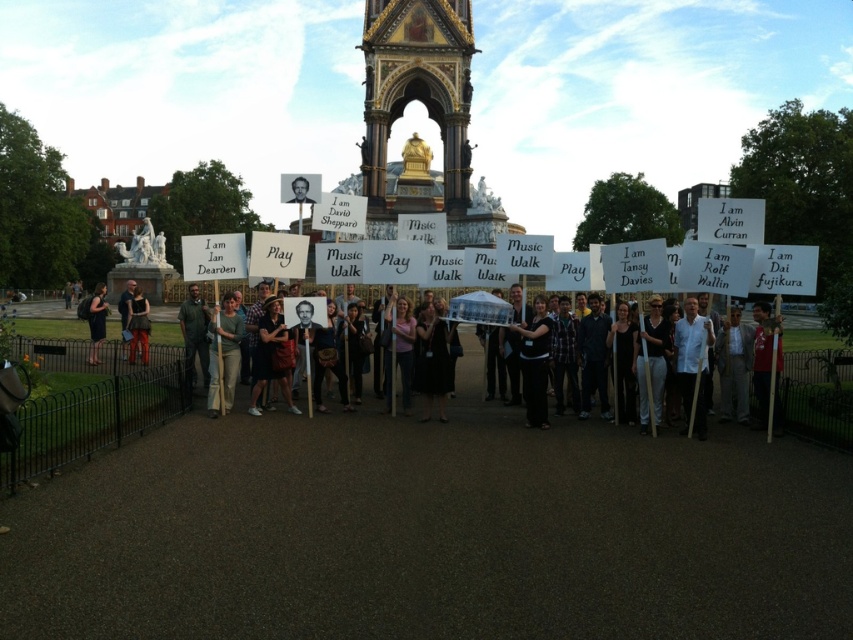
You are a photographer trying to capture a candid shot of the matte black dress at center and the dark brown leather jacket at center. Since you want both items to be clearly visible in the frame, which one should you focus on first to ensure proper depth of field?

The matte black dress at center is much taller than the dark brown leather jacket at center, so focusing on the taller matte black dress at center first would ensure both are in focus due to its greater distance from the camera.

You are a photographer trying to capture a photo of both the dark green shirt at center and the dark brown leather jacket at center. Since you want both to be clearly visible in the photo, which one should you focus on first to ensure the other remains in focus?

You should focus on the dark green shirt at center first because it is closer to the viewer than the dark brown leather jacket at center. By focusing on the closer object, the farther one will still be in focus due to the depth of field.

You are a photographer at the event and need to capture a photo where both the matte black dress at center and the dark brown leather jacket at center are clearly visible. Given their sizes, which one might you need to position closer to the camera to ensure both are in focus?

The matte black dress at center is smaller than the dark brown leather jacket at center. To ensure both are in focus, position the matte black dress at center closer to the camera since its smaller size requires it to be nearer for clarity.